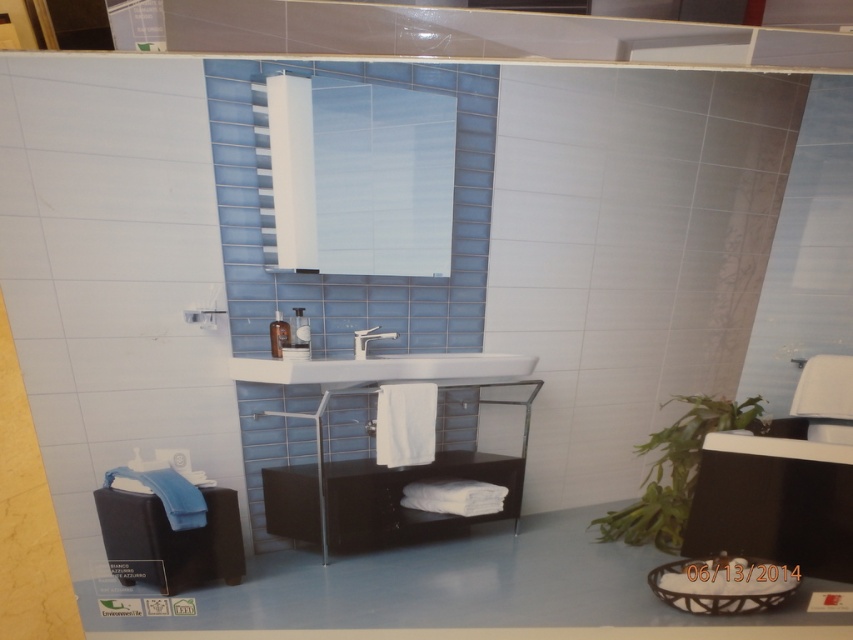
Which is more to the right, matte black stool at lower left or matte silver faucet at center?

Positioned to the right is matte silver faucet at center.

Between matte black stool at lower left and matte silver faucet at center, which one is positioned higher?

Positioned higher is matte silver faucet at center.

The width and height of the screenshot is (853, 640). In order to click on matte black stool at lower left in this screenshot , I will do `click(170, 540)`.

Which is in front, point (283, 486) or point (146, 500)?

Point (146, 500) is in front.

Does black glossy vanity at center come in front of matte black stool at lower left?

No.

Does point (486, 476) lie in front of point (138, 520)?

No, it is not.

What are the coordinates of `black glossy vanity at center` in the screenshot? It's located at (379, 483).

The width and height of the screenshot is (853, 640). What do you see at coordinates (379, 483) in the screenshot?
I see `black glossy vanity at center` at bounding box center [379, 483].

Can you confirm if black glossy vanity at center is shorter than white glossy sink at center?

Incorrect, black glossy vanity at center's height does not fall short of white glossy sink at center's.

Where is `black glossy vanity at center`? This screenshot has width=853, height=640. black glossy vanity at center is located at coordinates (379, 483).